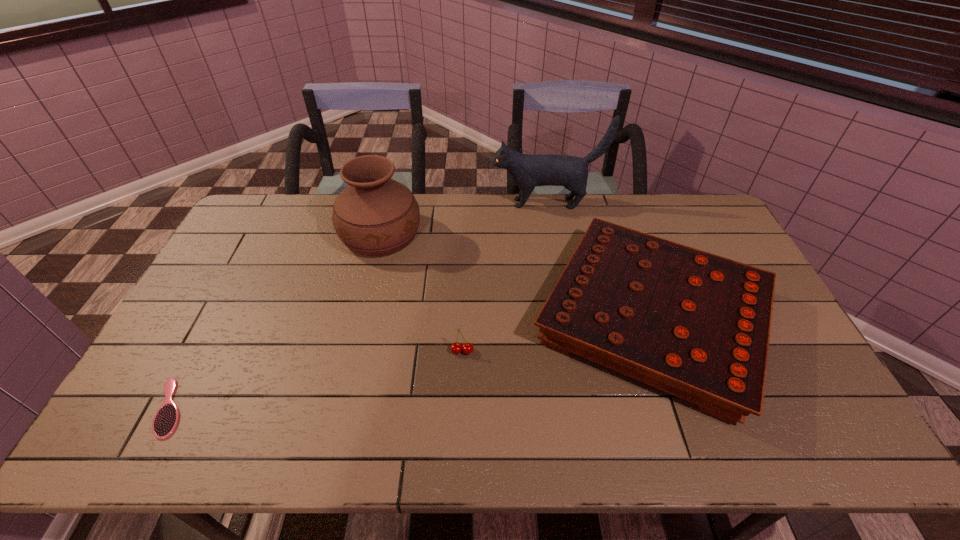
Find the location of a particular element. free space that satisfies the following two spatial constraints: 1. on the front side of the third tallest object; 2. on the left side of the fourth object from right to left is located at coordinates (361, 319).